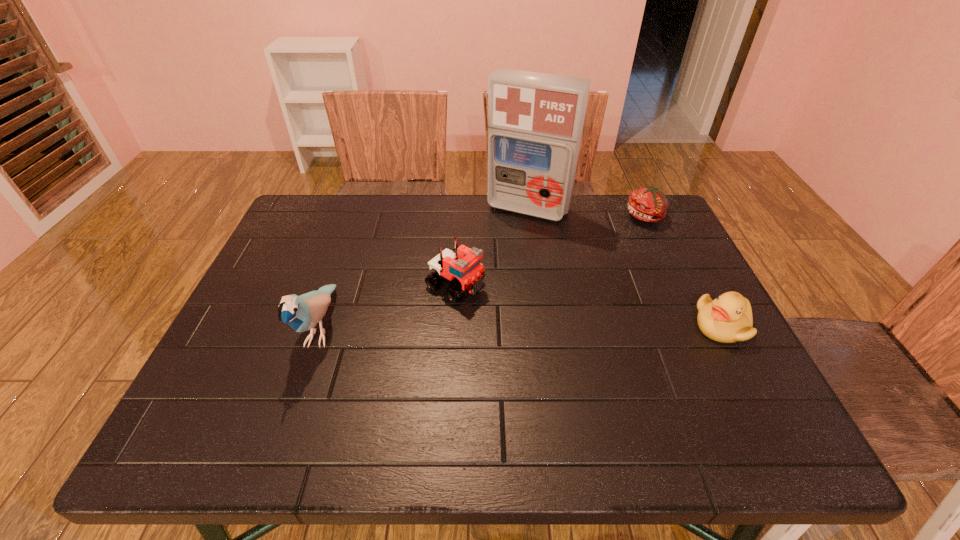
Find the location of a particular element. The height and width of the screenshot is (540, 960). free spot on the desktop that is between the second tallest object and the duckling and is positioned on the front-facing side of the tomato is located at coordinates (553, 327).

Find the location of a particular element. The width and height of the screenshot is (960, 540). vacant space on the desktop that is between the fourth shortest object and the duckling and is positioned on the front-facing side of the third tallest object is located at coordinates (533, 327).

Locate an element on the screen. vacant spot on the desktop that is between the leftmost object and the duckling and is positioned on the front-facing side of the first-aid kit is located at coordinates (463, 327).